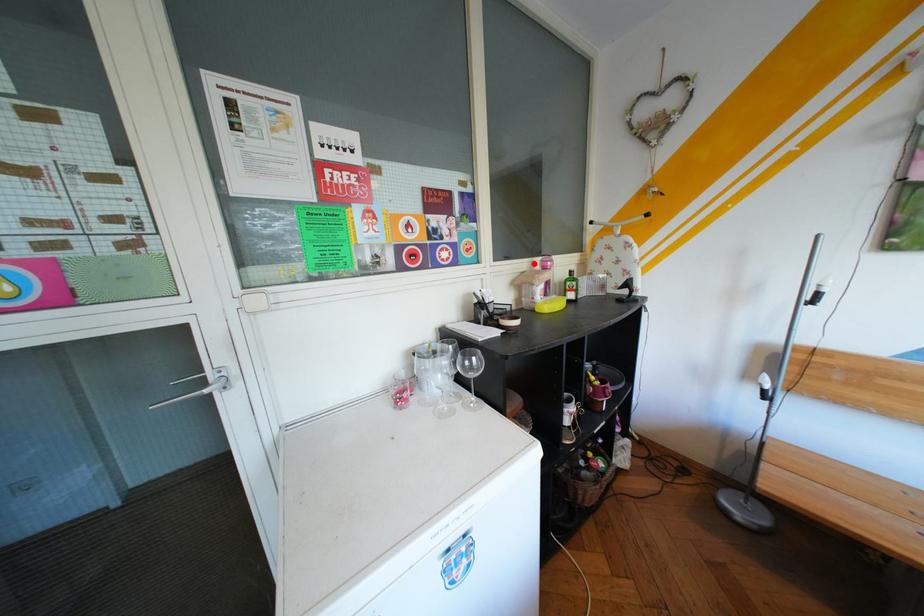
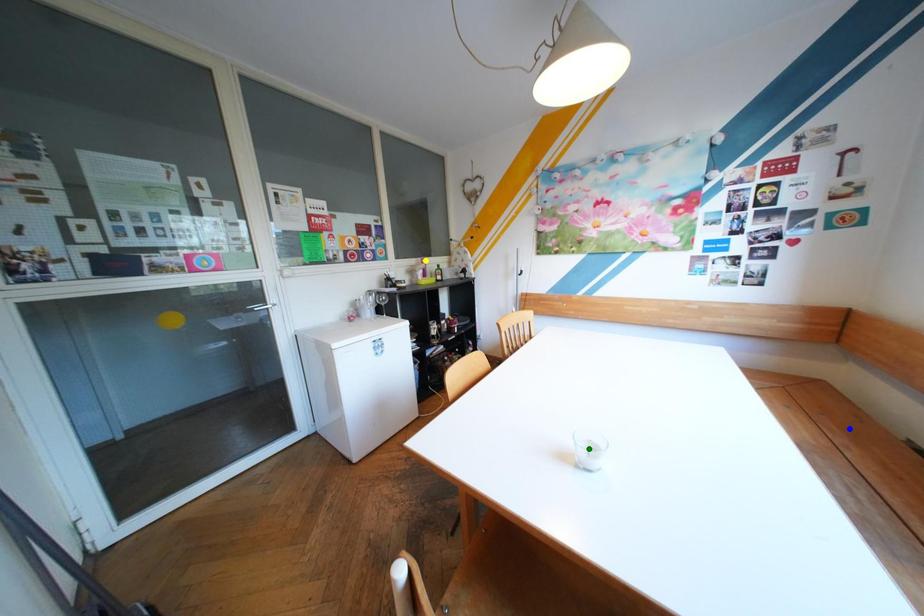
Question: I am providing you with two images of the same scene from different viewpoints. A red point is marked on the first image. You are given multiple points on the second image. Which point in image 2 is actually the same real-world point as the red point in image 1?

Choices:
 (A) green point
 (B) yellow point
 (C) blue point

Answer: (B)